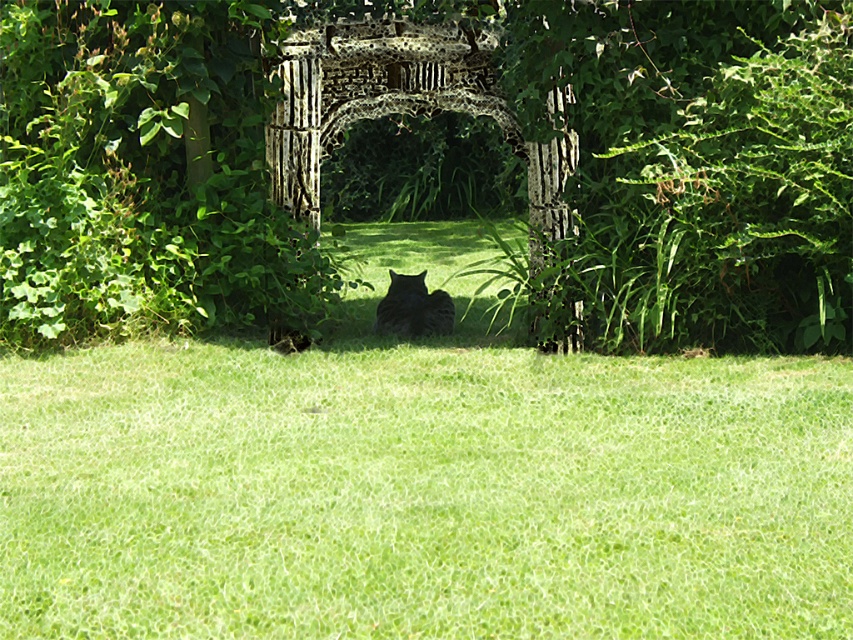
Is green grass at center above green leafy bush at right?

No, green grass at center is not above green leafy bush at right.

Is point (550, 376) less distant than point (784, 296)?

That is True.

This screenshot has height=640, width=853. I want to click on green grass at center, so click(x=422, y=493).

Does green leafy bush at right have a greater height compared to dark gray fur cat at center?

Yes, green leafy bush at right is taller than dark gray fur cat at center.

Based on the photo, is green leafy bush at right above dark gray fur cat at center?

Yes.

Locate an element on the screen. The height and width of the screenshot is (640, 853). green leafy bush at right is located at coordinates (738, 208).

Is point (682, 99) less distant than point (552, 115)?

Yes, it is.

Is green leafy tree at center positioned before wooden lattice archway at center?

No, it is behind wooden lattice archway at center.

Which is in front, point (572, 179) or point (457, 29)?

Point (572, 179) is more forward.

In order to click on green leafy tree at center in this screenshot , I will do `click(427, 116)`.